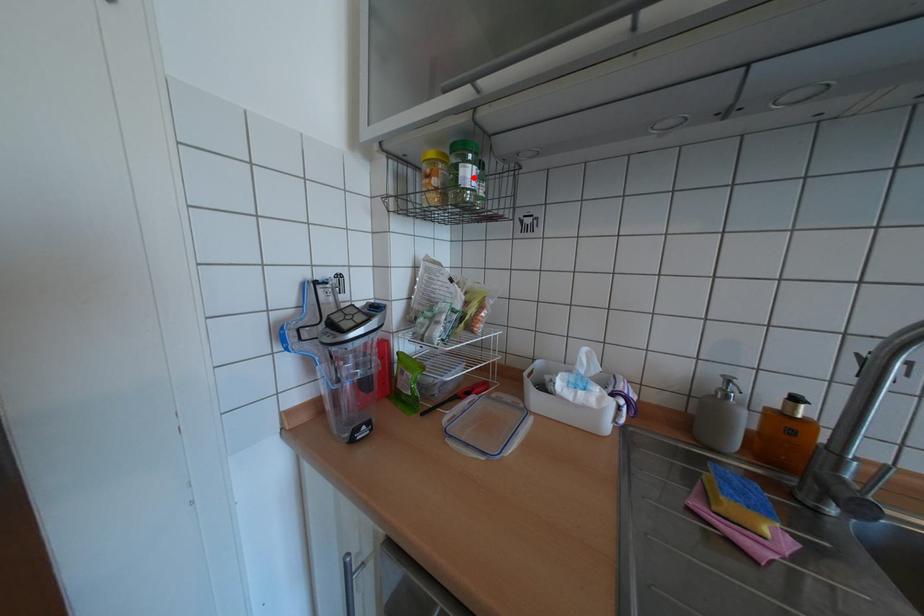
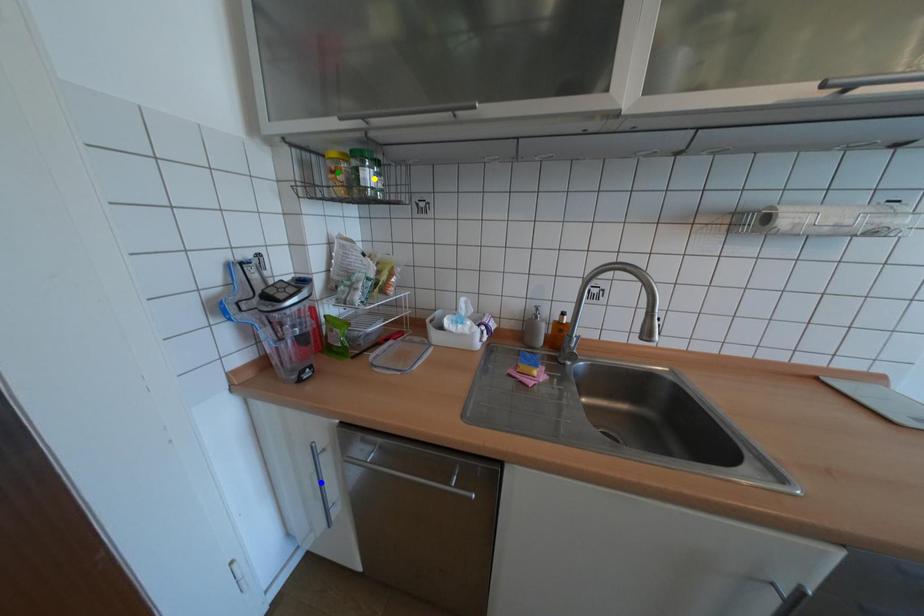
Question: I am providing you with two images of the same scene from different viewpoints. A red point is marked on the first image. You are given multiple points on the second image. Which mark in image 2 goes with the point in image 1?

Choices:
 (A) blue point
 (B) green point
 (C) yellow point

Answer: (C)